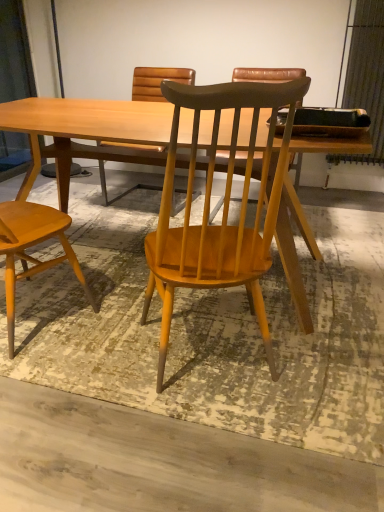
Identify the location of free spot to the right of light brown wood chair at left, positioned as the 2th chair in right-to-left order. This screenshot has width=384, height=512. (107, 330).